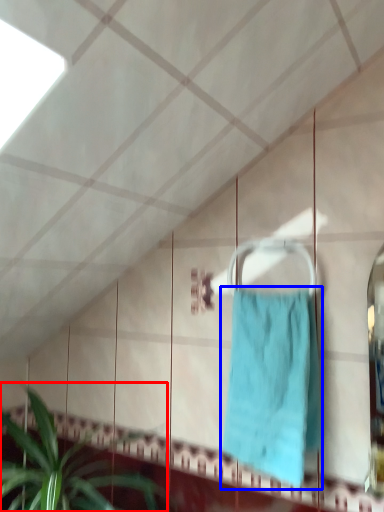
Question: Which point is further to the camera, houseplant (highlighted by a red box) or towel (highlighted by a blue box)?

Choices:
 (A) houseplant
 (B) towel

Answer: (B)